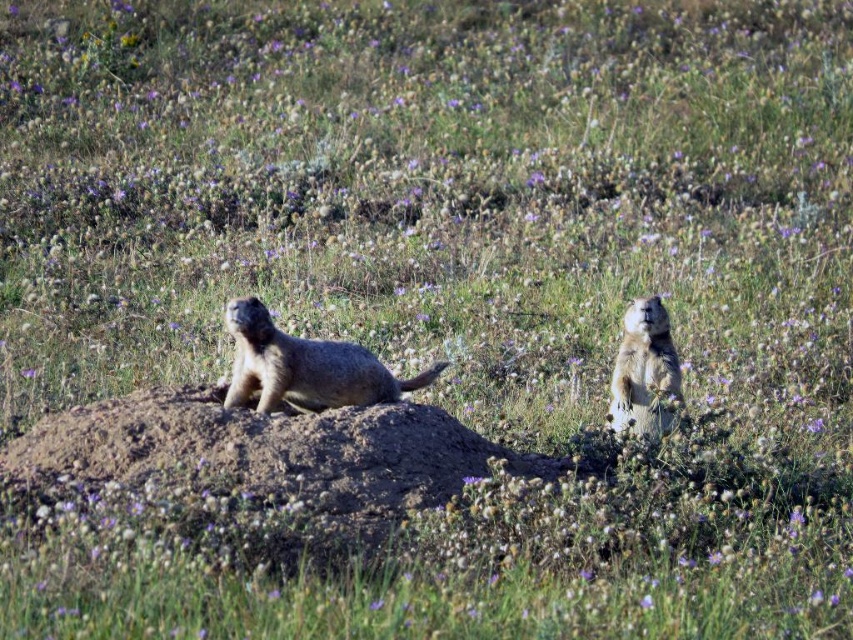
Question: Is brown dirt mound at center to the right of furry beige groundhog at right from the viewer's perspective?

Choices:
 (A) no
 (B) yes

Answer: (A)

Question: Which object appears farthest from the camera in this image?

Choices:
 (A) brown dirt mound at center
 (B) furry beige groundhog at right
 (C) fuzzy brown ground squirrel at center

Answer: (B)

Question: From the image, what is the correct spatial relationship of brown dirt mound at center in relation to furry beige groundhog at right?

Choices:
 (A) right
 (B) left

Answer: (B)

Question: Which is farther from the furry beige groundhog at right?

Choices:
 (A) fuzzy brown ground squirrel at center
 (B) brown dirt mound at center

Answer: (B)

Question: Among these points, which one is nearest to the camera?

Choices:
 (A) (231, 320)
 (B) (643, 394)

Answer: (A)

Question: Is brown dirt mound at center positioned behind fuzzy brown ground squirrel at center?

Choices:
 (A) yes
 (B) no

Answer: (B)